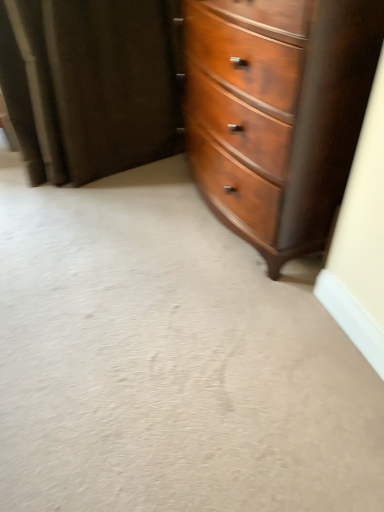
Question: Does point (329, 209) appear closer or farther from the camera than point (43, 28)?

Choices:
 (A) farther
 (B) closer

Answer: (B)

Question: From the image's perspective, is shiny brown wood chest of drawers at center above or below velvet dark brown curtain at upper left?

Choices:
 (A) above
 (B) below

Answer: (B)

Question: Considering the positions of shiny brown wood chest of drawers at center and velvet dark brown curtain at upper left in the image, is shiny brown wood chest of drawers at center taller or shorter than velvet dark brown curtain at upper left?

Choices:
 (A) short
 (B) tall

Answer: (B)

Question: Does point pos(26,84) appear closer or farther from the camera than point pos(296,108)?

Choices:
 (A) closer
 (B) farther

Answer: (B)

Question: Is velvet dark brown curtain at upper left inside the boundaries of shiny brown wood chest of drawers at center, or outside?

Choices:
 (A) outside
 (B) inside

Answer: (A)

Question: From a real-world perspective, is velvet dark brown curtain at upper left positioned above or below shiny brown wood chest of drawers at center?

Choices:
 (A) above
 (B) below

Answer: (B)

Question: In terms of size, does velvet dark brown curtain at upper left appear bigger or smaller than shiny brown wood chest of drawers at center?

Choices:
 (A) small
 (B) big

Answer: (A)